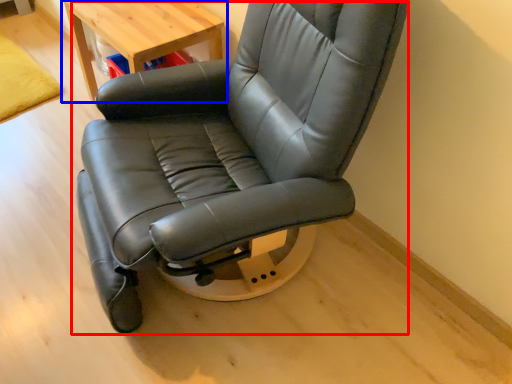
Question: Which point is further to the camera, chair (highlighted by a red box) or table (highlighted by a blue box)?

Choices:
 (A) chair
 (B) table

Answer: (B)